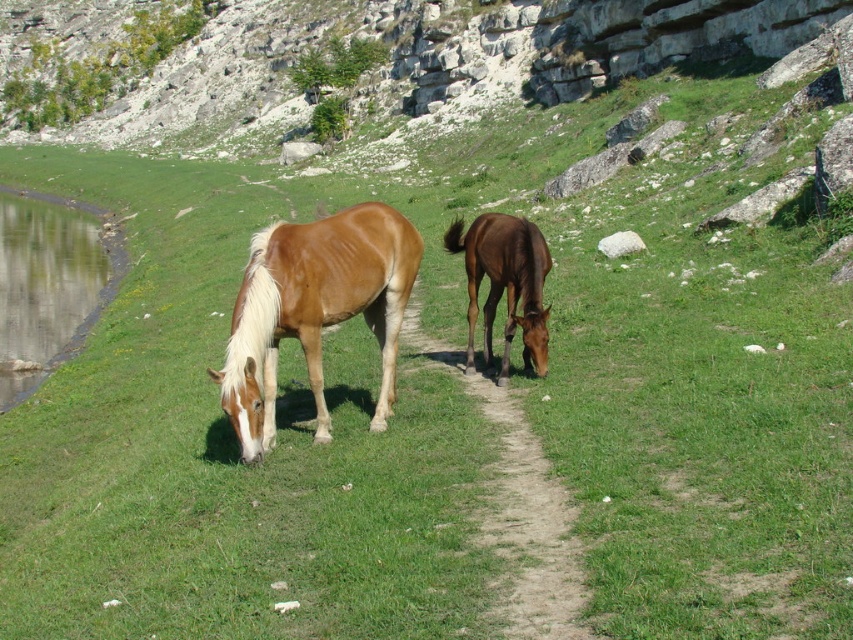
Question: Which point appears closest to the camera in this image?

Choices:
 (A) (543, 237)
 (B) (318, 284)
 (C) (22, 116)
 (D) (567, 612)

Answer: (D)

Question: Which of these objects is positioned closest to the rough stone hillside at upper center?

Choices:
 (A) brown glossy horse at center
 (B) dirt path at center
 (C) green grassy water at left

Answer: (C)

Question: Can you confirm if dirt path at center is bigger than brown glossy horse at center?

Choices:
 (A) no
 (B) yes

Answer: (B)

Question: Does rough stone hillside at upper center lie behind green grassy water at left?

Choices:
 (A) no
 (B) yes

Answer: (B)

Question: Which object is closer to the camera taking this photo?

Choices:
 (A) green grassy water at left
 (B) rough stone hillside at upper center
 (C) light brown glossy horse at left

Answer: (C)

Question: Where is light brown glossy horse at left located in relation to dirt path at center in the image?

Choices:
 (A) below
 (B) above

Answer: (B)